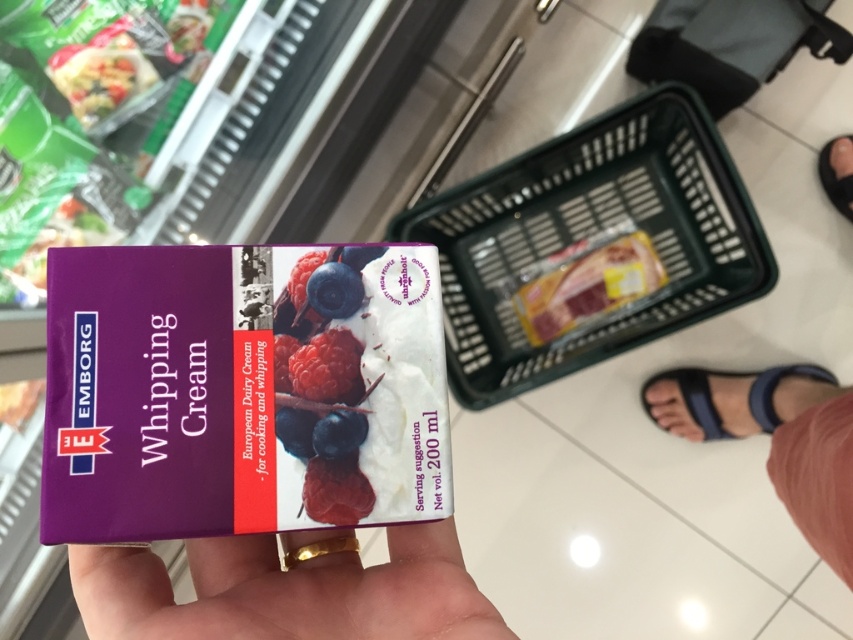
Who is positioned more to the right, purple matte skin at center or purple matte whipped cream at center?

From the viewer's perspective, purple matte whipped cream at center appears more on the right side.

Which is in front, point (283, 540) or point (345, 508)?

Point (345, 508)

I want to click on purple matte skin at center, so click(288, 589).

Can you confirm if purple matte whipped cream at center is thinner than blue matte/blueberry at center?

Incorrect, purple matte whipped cream at center's width is not less than blue matte/blueberry at center's.

Between purple matte whipped cream at center and blue matte/blueberry at center, which one is positioned higher?

purple matte whipped cream at center is higher up.

Does point (323, 340) lie behind point (329, 448)?

Yes, it is behind point (329, 448).

What are the coordinates of `purple matte whipped cream at center` in the screenshot? It's located at (323, 380).

Which is above, blueberry matte at center or black rubber sandal at lower right?

black rubber sandal at lower right

Is blueberry matte at center to the left of black rubber sandal at lower right from the viewer's perspective?

Yes, blueberry matte at center is to the left of black rubber sandal at lower right.

Is point (334, 296) in front of point (837, 179)?

Yes, it is.

At what (x,y) coordinates should I click in order to perform the action: click on blueberry matte at center. Please return your answer as a coordinate pair (x, y). Looking at the image, I should click on (334, 291).